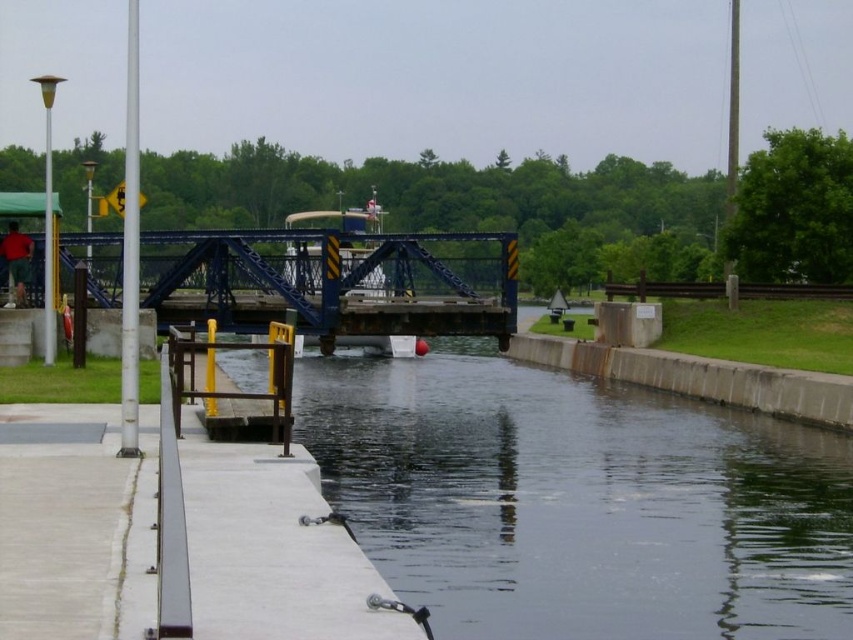
Which is behind, point (495, 602) or point (235, 300)?

Point (235, 300)

Is smooth concrete river at center smaller than blue metallic bridge at center?

Yes.

Measure the distance between point (257, 364) and camera.

Point (257, 364) and camera are 50.11 meters apart.

The width and height of the screenshot is (853, 640). I want to click on smooth concrete river at center, so click(x=578, y=500).